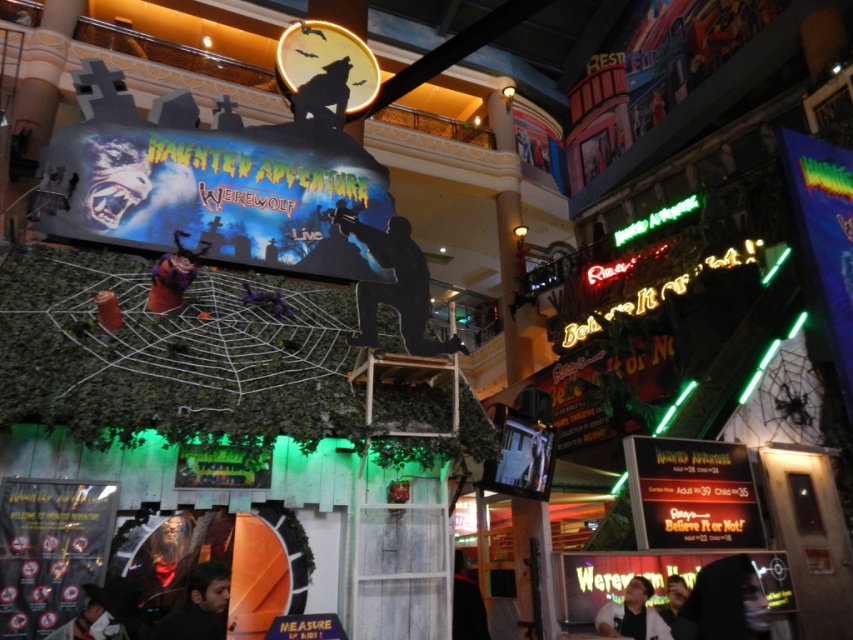
Question: Which object is closer to the camera taking this photo?

Choices:
 (A) dark hair at lower left
 (B) black matte silhouette at center
 (C) smooth skin face at lower right

Answer: (A)

Question: Can you confirm if white shirt at lower right is positioned to the right of smooth skin face at lower right?

Choices:
 (A) yes
 (B) no

Answer: (B)

Question: Which of the following is the closest to the observer?

Choices:
 (A) black matte silhouette at center
 (B) dark hair at lower left
 (C) black fabric person at center
 (D) smooth skin face at lower right

Answer: (B)

Question: Can you confirm if black fabric person at center is positioned to the right of matte black jacket at lower left?

Choices:
 (A) yes
 (B) no

Answer: (A)

Question: Is dark hair at lower left further to camera compared to black fabric person at center?

Choices:
 (A) no
 (B) yes

Answer: (A)

Question: Which object is positioned farthest from the black fabric person at center?

Choices:
 (A) smooth skin face at lower right
 (B) dark hair at lower left
 (C) black matte silhouette at center
 (D) dark matte hood at lower right

Answer: (C)